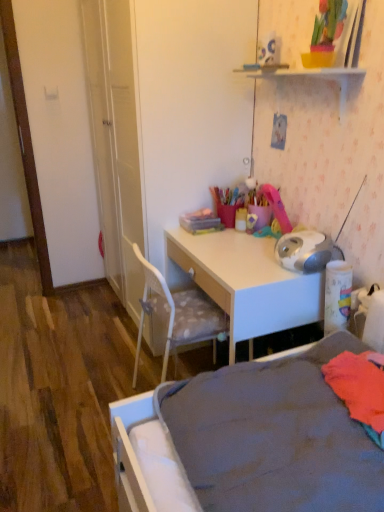
Question: From the image's perspective, is white glossy desk at center above gray fabric bed at lower right?

Choices:
 (A) yes
 (B) no

Answer: (A)

Question: Considering the relative sizes of white glossy desk at center and gray fabric bed at lower right in the image provided, is white glossy desk at center taller than gray fabric bed at lower right?

Choices:
 (A) no
 (B) yes

Answer: (B)

Question: Is white glossy desk at center to the right of gray fabric bed at lower right from the viewer's perspective?

Choices:
 (A) no
 (B) yes

Answer: (A)

Question: Can you confirm if white glossy desk at center is positioned to the left of gray fabric bed at lower right?

Choices:
 (A) yes
 (B) no

Answer: (A)

Question: Is white glossy desk at center with gray fabric bed at lower right?

Choices:
 (A) no
 (B) yes

Answer: (A)

Question: In terms of width, does white plastic shelf at upper center look wider or thinner when compared to white glossy desk at center?

Choices:
 (A) wide
 (B) thin

Answer: (B)

Question: Would you say white plastic shelf at upper center is to the left or to the right of white glossy desk at center in the picture?

Choices:
 (A) right
 (B) left

Answer: (A)

Question: Is white plastic shelf at upper center spatially inside white glossy desk at center, or outside of it?

Choices:
 (A) inside
 (B) outside

Answer: (B)

Question: Considering the positions of point (304, 75) and point (178, 246), is point (304, 75) closer or farther from the camera than point (178, 246)?

Choices:
 (A) closer
 (B) farther

Answer: (A)

Question: Looking at the image, does gray fabric bed at lower right seem bigger or smaller compared to white glossy desk at center?

Choices:
 (A) small
 (B) big

Answer: (A)

Question: Is point (276, 378) positioned closer to the camera than point (273, 292)?

Choices:
 (A) closer
 (B) farther

Answer: (A)

Question: Would you say gray fabric bed at lower right is inside or outside white glossy desk at center?

Choices:
 (A) inside
 (B) outside

Answer: (B)

Question: Would you say gray fabric bed at lower right is to the left or to the right of white glossy desk at center in the picture?

Choices:
 (A) left
 (B) right

Answer: (B)

Question: From a real-world perspective, is white glossy desk at center physically located above or below gray fabric bed at lower right?

Choices:
 (A) below
 (B) above

Answer: (A)

Question: In terms of size, does white glossy desk at center appear bigger or smaller than gray fabric bed at lower right?

Choices:
 (A) big
 (B) small

Answer: (A)